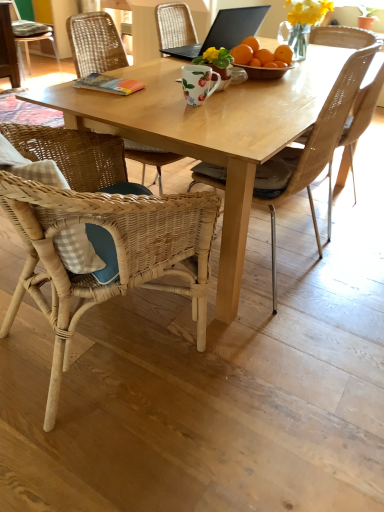
In order to click on free location in front of woven wood chair at center, which appears as the 3th chair when viewed from the back in this screenshot , I will do `click(299, 337)`.